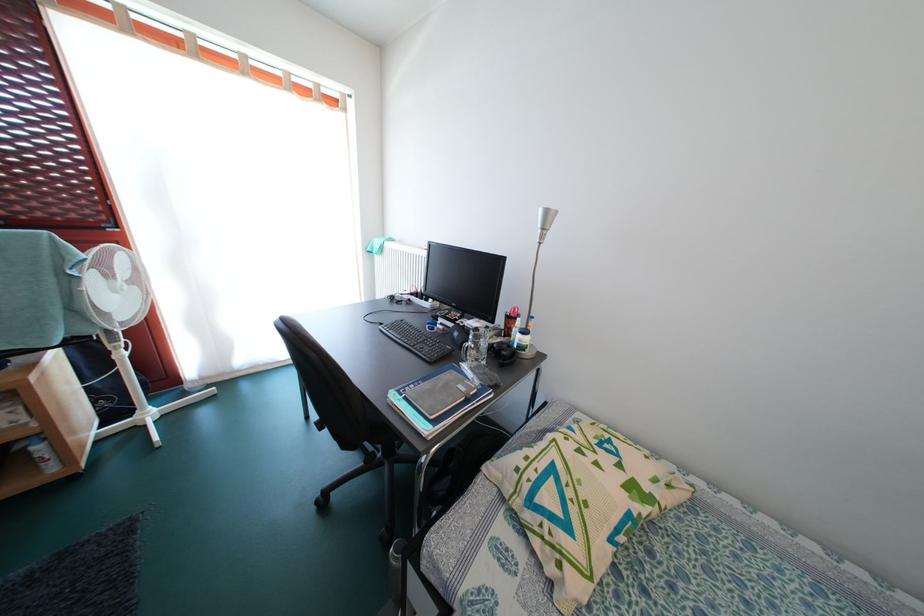
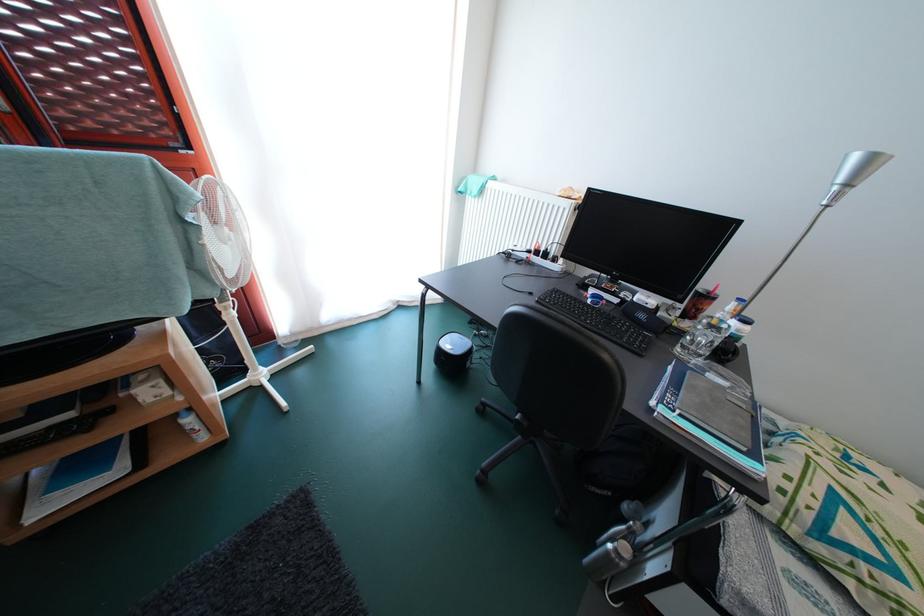
Question: Based on the continuous images, in which direction is the camera rotating? Reply with the corresponding letter.

Choices:
 (A) Left
 (B) Right
 (C) Up
 (D) Down

Answer: (D)